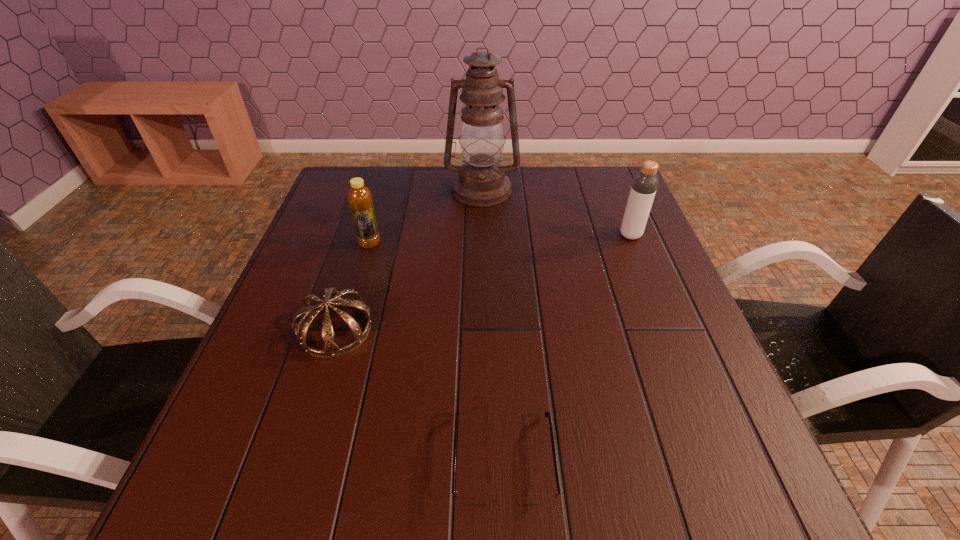
Locate an element on the screen. The width and height of the screenshot is (960, 540). the farthest object is located at coordinates (481, 182).

Identify the location of oil lamp. (481, 182).

I want to click on the right bottle, so click(x=645, y=183).

What are the coordinates of `the left bottle` in the screenshot? It's located at 360,200.

This screenshot has height=540, width=960. Identify the location of tiara. [x=332, y=298].

Find the location of a particular element. the second nearest object is located at coordinates (332, 298).

I want to click on spectacles, so click(x=466, y=500).

Find the location of a particular element. The height and width of the screenshot is (540, 960). the shortest object is located at coordinates (466, 500).

Where is `free space located 0.160m on the right of the tallest object`? The height and width of the screenshot is (540, 960). free space located 0.160m on the right of the tallest object is located at coordinates (571, 190).

In order to click on vacant space positioned on the left of the rightmost object in this screenshot , I will do `click(469, 235)`.